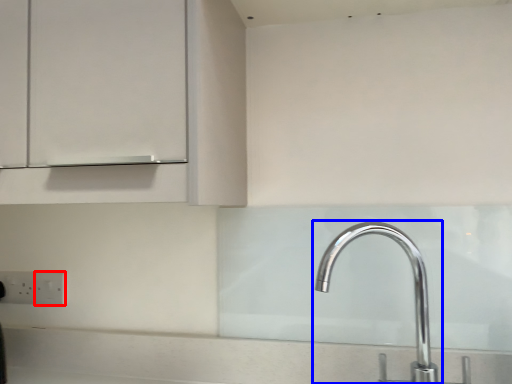
Question: Which of the following is the closest to the observer, electric outlet (highlighted by a red box) or tap (highlighted by a blue box)?

Choices:
 (A) electric outlet
 (B) tap

Answer: (B)